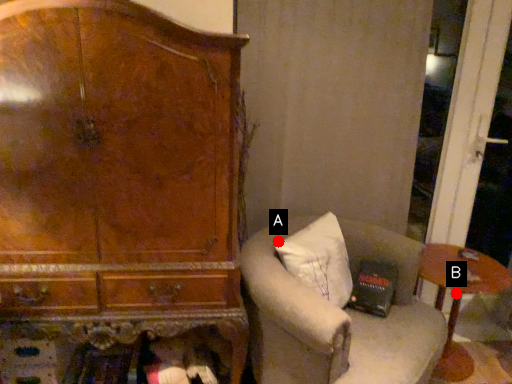
Question: Two points are circled on the image, labeled by A and B beside each circle. Among these points, which one is farthest from the camera?

Choices:
 (A) A is further
 (B) B is further

Answer: (B)